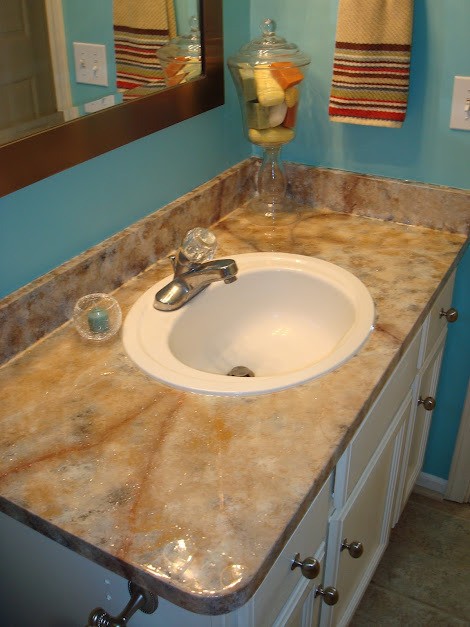
Find the location of a particular element. toilet paper roll is located at coordinates (116, 616).